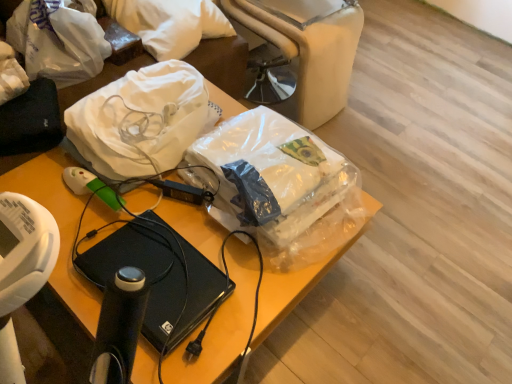
Describe the element at coordinates (140, 122) in the screenshot. I see `transparent plastic bag at upper center, placed as the second plastic bag when sorted from right to left` at that location.

In order to face transparent plastic bag at upper center, the 2th plastic bag in the left-to-right sequence, should I rotate leftwards or rightwards?

It's best to rotate left around 12.872 degrees.

Locate an element on the screen. This screenshot has height=384, width=512. black plastic laptop at center is located at coordinates click(59, 228).

The width and height of the screenshot is (512, 384). Identify the location of beige fabric bean bag chair at upper center. (308, 49).

The width and height of the screenshot is (512, 384). What do you see at coordinates (59, 40) in the screenshot? I see `white matte plastic bag at upper left, which is the 1th plastic bag in left-to-right order` at bounding box center [59, 40].

Locate an element on the screen. white matte plastic bag at upper left, which ranks as the 3th plastic bag in right-to-left order is located at coordinates (59, 40).

I want to click on black matte laptop at center, so click(x=160, y=276).

Relative to beige fabric bean bag chair at upper center, is translucent plastic bag at center, positioned as the 3th plastic bag in left-to-right order, in front or behind?

translucent plastic bag at center, positioned as the 3th plastic bag in left-to-right order, is in front of beige fabric bean bag chair at upper center.

Which object is thinner, translucent plastic bag at center, which appears as the 1th plastic bag when viewed from the right, or beige fabric bean bag chair at upper center?

translucent plastic bag at center, which appears as the 1th plastic bag when viewed from the right.

Can you confirm if translucent plastic bag at center, which appears as the 1th plastic bag when viewed from the right, is smaller than beige fabric bean bag chair at upper center?

Yes.

Is point (304, 264) in front of point (348, 62)?

That is True.

From a real-world perspective, which is physically above, transparent plastic bag at upper center, placed as the second plastic bag when sorted from right to left, or black matte laptop at center?

transparent plastic bag at upper center, placed as the second plastic bag when sorted from right to left.

Does transparent plastic bag at upper center, placed as the second plastic bag when sorted from right to left, have a larger size compared to black matte laptop at center?

Yes.

Is point (150, 102) behind point (204, 292)?

That is True.

From the image's perspective, is black matte laptop at center over black plastic laptop at center?

No, from the image's perspective, black matte laptop at center is not over black plastic laptop at center.

Where is `furniture in front of the black matte laptop at center`? The image size is (512, 384). furniture in front of the black matte laptop at center is located at coordinates (59, 228).

From a real-world perspective, between black matte laptop at center and black plastic laptop at center, who is vertically higher?

In real-world perspective, black matte laptop at center is above.

Which point is more forward, (187, 38) or (280, 243)?

The point (280, 243) is closer to the camera.

Could you tell me if white soft pillow at upper left is facing translucent plastic bag at center, which appears as the 1th plastic bag when viewed from the right?

Yes, white soft pillow at upper left faces towards translucent plastic bag at center, which appears as the 1th plastic bag when viewed from the right.

Does white soft pillow at upper left have a greater width compared to translucent plastic bag at center, which appears as the 1th plastic bag when viewed from the right?

No.

Which object is closer to the camera taking this photo, white soft pillow at upper left or translucent plastic bag at center, which appears as the 1th plastic bag when viewed from the right?

Positioned in front is translucent plastic bag at center, which appears as the 1th plastic bag when viewed from the right.

Can you see white soft pillow at upper left touching black matte laptop at center?

No, white soft pillow at upper left is not next to black matte laptop at center.

Consider the image. Considering the relative positions of white soft pillow at upper left and black matte laptop at center in the image provided, is white soft pillow at upper left behind black matte laptop at center?

That is True.

At what (x,y) coordinates should I click in order to perform the action: click on computer on the right of the white soft pillow at upper left. Please return your answer as a coordinate pair (x, y). Image resolution: width=512 pixels, height=384 pixels. Looking at the image, I should click on (160, 276).

Measure the distance from white soft pillow at upper left to black matte laptop at center.

A distance of 93.01 centimeters exists between white soft pillow at upper left and black matte laptop at center.

Is beige fabric bean bag chair at upper center at the right side of white soft pillow at upper left?

Yes, beige fabric bean bag chair at upper center is to the right of white soft pillow at upper left.

How many degrees apart are the facing directions of beige fabric bean bag chair at upper center and white soft pillow at upper left?

They differ by 0.343 degrees in their facing directions.

Is beige fabric bean bag chair at upper center facing away from white soft pillow at upper left?

No, beige fabric bean bag chair at upper center is not facing the opposite direction of white soft pillow at upper left.

How different are the orientations of white matte plastic bag at upper left, which ranks as the 3th plastic bag in right-to-left order, and black plastic laptop at center in degrees?

0.342 degrees separate the facing orientations of white matte plastic bag at upper left, which ranks as the 3th plastic bag in right-to-left order, and black plastic laptop at center.

Where is `furniture below the white matte plastic bag at upper left, which is the 1th plastic bag in left-to-right order (from the image's perspective)`? This screenshot has height=384, width=512. furniture below the white matte plastic bag at upper left, which is the 1th plastic bag in left-to-right order (from the image's perspective) is located at coordinates (59, 228).

Is white matte plastic bag at upper left, which is the 1th plastic bag in left-to-right order, oriented towards black plastic laptop at center?

Yes, white matte plastic bag at upper left, which is the 1th plastic bag in left-to-right order, faces towards black plastic laptop at center.

Does white matte plastic bag at upper left, which is the 1th plastic bag in left-to-right order, have a larger size compared to black plastic laptop at center?

No, white matte plastic bag at upper left, which is the 1th plastic bag in left-to-right order, is not bigger than black plastic laptop at center.

The image size is (512, 384). In the image, there is a translucent plastic bag at center, positioned as the 3th plastic bag in left-to-right order. In order to click on bean bag chair below it (from a real-world perspective) in this screenshot , I will do `click(308, 49)`.

Where is `computer below the transparent plastic bag at upper center, the 2th plastic bag in the left-to-right sequence (from the image's perspective)`? The height and width of the screenshot is (384, 512). computer below the transparent plastic bag at upper center, the 2th plastic bag in the left-to-right sequence (from the image's perspective) is located at coordinates (160, 276).

Looking at the image, which one is located further to white soft pillow at upper left, white matte plastic bag at upper left, which ranks as the 3th plastic bag in right-to-left order, or translucent plastic bag at center, positioned as the 3th plastic bag in left-to-right order?

translucent plastic bag at center, positioned as the 3th plastic bag in left-to-right order, is positioned further to the anchor white soft pillow at upper left.

Which object lies nearer to the anchor point white matte plastic bag at upper left, which ranks as the 3th plastic bag in right-to-left order, translucent plastic bag at center, which appears as the 1th plastic bag when viewed from the right, or black plastic laptop at center?

Among the two, black plastic laptop at center is located nearer to white matte plastic bag at upper left, which ranks as the 3th plastic bag in right-to-left order.

From the image, which object appears to be farther from transparent plastic bag at upper center, placed as the second plastic bag when sorted from right to left, white soft pillow at upper left or black plastic laptop at center?

white soft pillow at upper left is positioned further to the anchor transparent plastic bag at upper center, placed as the second plastic bag when sorted from right to left.

Considering their positions, is black plastic laptop at center positioned closer to translucent plastic bag at center, positioned as the 3th plastic bag in left-to-right order, than white matte plastic bag at upper left, which is the 1th plastic bag in left-to-right order?

black plastic laptop at center lies closer to translucent plastic bag at center, positioned as the 3th plastic bag in left-to-right order, than the other object.

Which object lies further to the anchor point transparent plastic bag at upper center, placed as the second plastic bag when sorted from right to left, white soft pillow at upper left or beige fabric bean bag chair at upper center?

beige fabric bean bag chair at upper center lies further to transparent plastic bag at upper center, placed as the second plastic bag when sorted from right to left, than the other object.

Looking at the image, which one is located closer to beige fabric bean bag chair at upper center, translucent plastic bag at center, positioned as the 3th plastic bag in left-to-right order, or black plastic laptop at center?

translucent plastic bag at center, positioned as the 3th plastic bag in left-to-right order, is closer to beige fabric bean bag chair at upper center.

Estimate the real-world distances between objects in this image. Which object is closer to black matte laptop at center, white matte plastic bag at upper left, which ranks as the 3th plastic bag in right-to-left order, or transparent plastic bag at upper center, the 2th plastic bag in the left-to-right sequence?

transparent plastic bag at upper center, the 2th plastic bag in the left-to-right sequence, is positioned closer to the anchor black matte laptop at center.

When comparing their distances from translucent plastic bag at center, positioned as the 3th plastic bag in left-to-right order, does beige fabric bean bag chair at upper center or white matte plastic bag at upper left, which is the 1th plastic bag in left-to-right order, seem further?

Based on the image, white matte plastic bag at upper left, which is the 1th plastic bag in left-to-right order, appears to be further to translucent plastic bag at center, positioned as the 3th plastic bag in left-to-right order.

The width and height of the screenshot is (512, 384). Identify the location of plastic bag situated between white matte plastic bag at upper left, which ranks as the 3th plastic bag in right-to-left order, and translucent plastic bag at center, positioned as the 3th plastic bag in left-to-right order, from left to right. (140, 122).

The width and height of the screenshot is (512, 384). Find the location of `bean bag chair between white soft pillow at upper left and translucent plastic bag at center, positioned as the 3th plastic bag in left-to-right order, from top to bottom`. bean bag chair between white soft pillow at upper left and translucent plastic bag at center, positioned as the 3th plastic bag in left-to-right order, from top to bottom is located at coordinates (308, 49).

At what (x,y) coordinates should I click in order to perform the action: click on bean bag chair between white soft pillow at upper left and black matte laptop at center vertically. Please return your answer as a coordinate pair (x, y). The image size is (512, 384). Looking at the image, I should click on pos(308,49).

I want to click on bean bag chair between white soft pillow at upper left and black plastic laptop at center in the vertical direction, so pos(308,49).